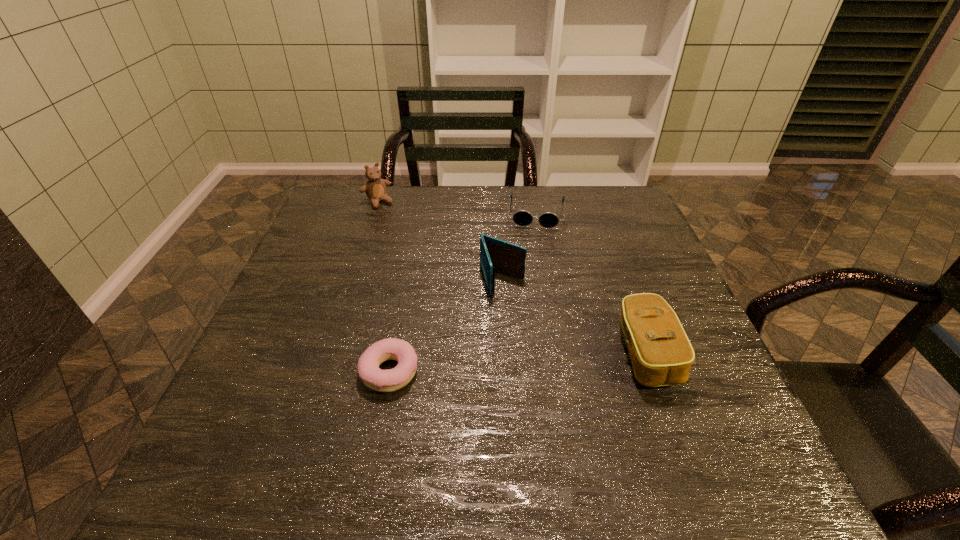
You are a GUI agent. You are given a task and a screenshot of the screen. Output one action in this format:
    pyautogui.click(x=<x>, y=<y>)
    Task: Click on the vacant spot on the desktop that is between the shortest object and the clutch bag and is positioned on the front-facing side of the leftmost object
    
    Given the screenshot: What is the action you would take?
    pyautogui.click(x=514, y=362)

You are a GUI agent. You are given a task and a screenshot of the screen. Output one action in this format:
    pyautogui.click(x=<x>, y=<y>)
    Task: Click on the free space on the desktop that is between the second object from left to right and the rightmost object and is positioned on the front-facing side of the sunglasses
    
    Given the screenshot: What is the action you would take?
    pyautogui.click(x=525, y=361)

I want to click on vacant space on the desktop that is between the fourth object from right to left and the clutch bag and is positioned on the exterior surface of the wallet, so click(x=531, y=361).